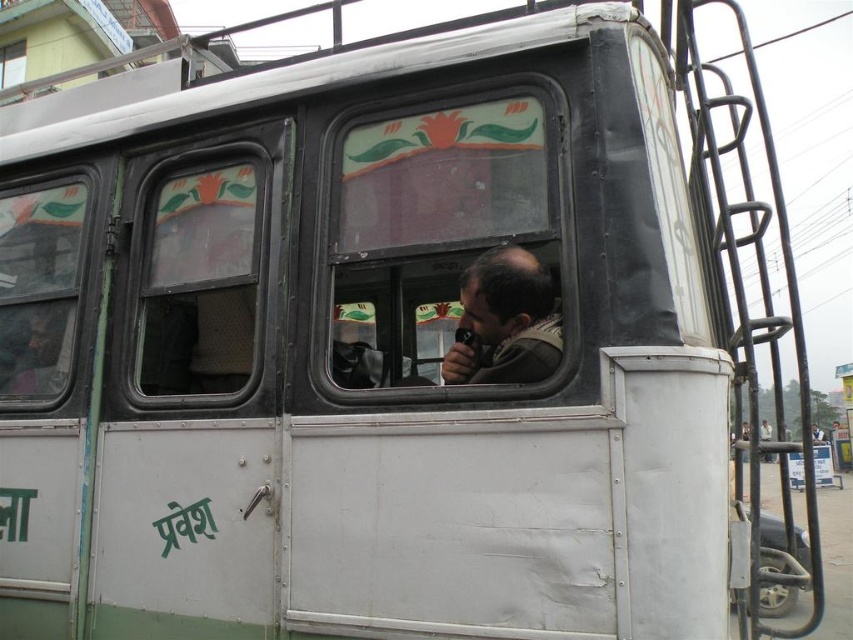
You are a passenger trying to look outside through the transparent glass window at center. Can you see the dark brown leather jacket at center through the window?

The transparent glass window at center is in front of the dark brown leather jacket at center, so yes, you can see the dark brown leather jacket at center through the transparent glass window at center.

You are a delivery person carrying a package that is 3 feet wide. You need to place it between the clear glass window at center left and the dark brown leather jacket at center. Is there enough space?

The clear glass window at center left is 33.21 inches from the dark brown leather jacket at center. Since 33.21 inches is approximately 2.77 feet, which is less than the package width of 3 feet, there isn

Based on the photo, you are a delivery person standing next to a public transport vehicle. You need to check if your package can be delivered through the transparent glass window at center. The package is 6 feet long. Can the package fit through the window?

The transparent glass window at center and camera are 6.04 feet apart from each other. Since the package is 6 feet long, it can fit through the window as the distance between the window and camera is slightly longer than the package.